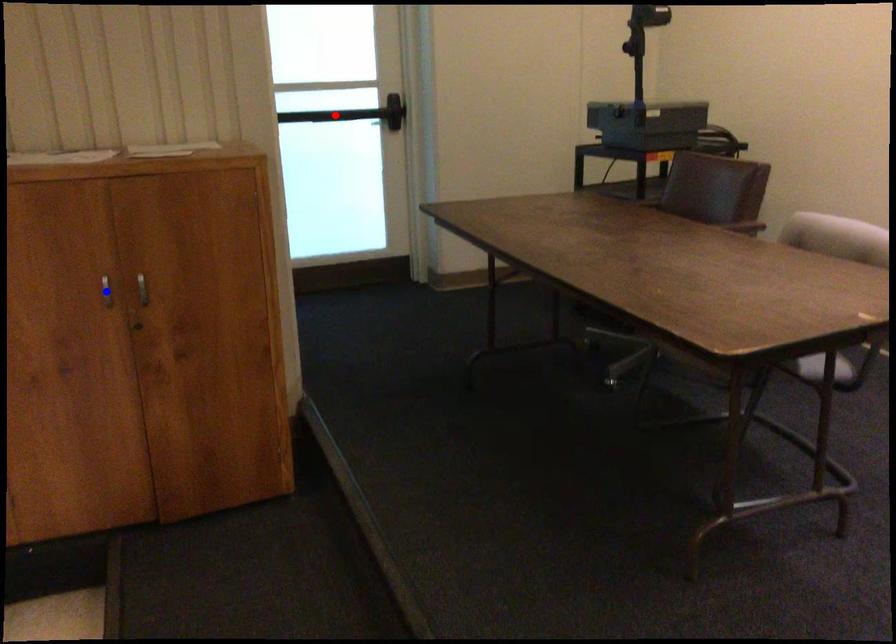
Question: Two points are marked on the image. Which point is closer to the camera?

Choices:
 (A) Blue point is closer.
 (B) Red point is closer.

Answer: (A)